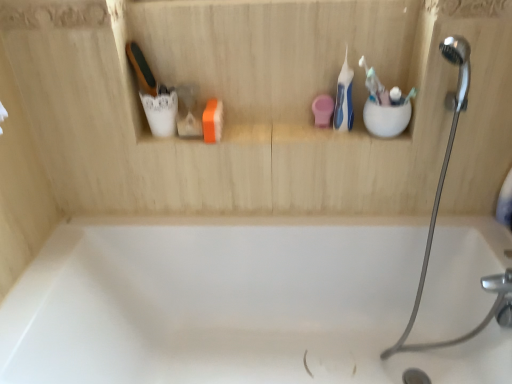
Image resolution: width=512 pixels, height=384 pixels. Describe the element at coordinates (374, 85) in the screenshot. I see `white plastic toothbrush at upper right, which is counted as the second toothbrush, starting from the left` at that location.

What do you see at coordinates (441, 171) in the screenshot? I see `silver metallic shower head at upper right` at bounding box center [441, 171].

This screenshot has height=384, width=512. I want to click on white glossy bathtub at center, so click(228, 305).

The image size is (512, 384). In order to click on white plastic toothbrush at upper right, the second toothbrush when ordered from right to left in this screenshot , I will do `click(374, 85)`.

From a real-world perspective, is white glossy bathtub at center physically above white plastic toothbrush at upper right, which is counted as the second toothbrush, starting from the left?

No, from a real-world perspective, white glossy bathtub at center is not on top of white plastic toothbrush at upper right, which is counted as the second toothbrush, starting from the left.

Who is shorter, white glossy bathtub at center or white plastic toothbrush at upper right, which is counted as the second toothbrush, starting from the left?

white plastic toothbrush at upper right, which is counted as the second toothbrush, starting from the left.

From the image's perspective, is white glossy bathtub at center above or below white plastic toothbrush at upper right, the second toothbrush when ordered from right to left?

white glossy bathtub at center is situated lower than white plastic toothbrush at upper right, the second toothbrush when ordered from right to left, in the image.

Is white glossy bathtub at center not near white plastic toothbrush at upper right, the second toothbrush when ordered from right to left?

Actually, white glossy bathtub at center and white plastic toothbrush at upper right, the second toothbrush when ordered from right to left, are a little close together.

Considering the positions of point (346, 95) and point (456, 113), is point (346, 95) closer or farther from the camera than point (456, 113)?

Point (346, 95) is farther from the camera than point (456, 113).

From a real-world perspective, is blue plastic toothbrush at upper right, arranged as the 3th toothbrush when viewed from the right, over silver metallic shower head at upper right?

Yes, from a real-world perspective, blue plastic toothbrush at upper right, arranged as the 3th toothbrush when viewed from the right, is above silver metallic shower head at upper right.

Which is in front, blue plastic toothbrush at upper right, the 1th toothbrush from the left, or silver metallic shower head at upper right?

Answer: silver metallic shower head at upper right is more forward.

Is point (105, 362) closer or farther from the camera than point (413, 87)?

Point (105, 362) is closer to the camera than point (413, 87).

Which of these two, white glossy bathtub at center or white plastic toothbrush at upper right, which is counted as the 1th toothbrush, starting from the right, is smaller?

With smaller size is white plastic toothbrush at upper right, which is counted as the 1th toothbrush, starting from the right.

From a real-world perspective, which is physically above, white glossy bathtub at center or white plastic toothbrush at upper right, which is counted as the 1th toothbrush, starting from the right?

white plastic toothbrush at upper right, which is counted as the 1th toothbrush, starting from the right, is physically above.

Can you tell me how much white glossy bathtub at center and white plastic toothbrush at upper right, the third toothbrush in the left-to-right sequence, differ in facing direction?

There is a 4.35-degree angle between the facing directions of white glossy bathtub at center and white plastic toothbrush at upper right, the third toothbrush in the left-to-right sequence.

In terms of height, does white plastic toothbrush at upper right, the third toothbrush in the left-to-right sequence, look taller or shorter compared to silver metallic shower head at upper right?

Clearly, white plastic toothbrush at upper right, the third toothbrush in the left-to-right sequence, is shorter compared to silver metallic shower head at upper right.

Which object is wider, white plastic toothbrush at upper right, the third toothbrush in the left-to-right sequence, or silver metallic shower head at upper right?

With larger width is silver metallic shower head at upper right.

Does white plastic toothbrush at upper right, the third toothbrush in the left-to-right sequence, come behind silver metallic shower head at upper right?

Yes, white plastic toothbrush at upper right, the third toothbrush in the left-to-right sequence, is further from the camera.

Where is `bathtub located in front of the blue plastic toothbrush at upper right, arranged as the 3th toothbrush when viewed from the right`? bathtub located in front of the blue plastic toothbrush at upper right, arranged as the 3th toothbrush when viewed from the right is located at coordinates (228, 305).

Which of these two, blue plastic toothbrush at upper right, the 1th toothbrush from the left, or white glossy bathtub at center, stands taller?

Standing taller between the two is white glossy bathtub at center.

From a real-world perspective, is blue plastic toothbrush at upper right, the 1th toothbrush from the left, above or below white glossy bathtub at center?

Clearly, from a real-world perspective, blue plastic toothbrush at upper right, the 1th toothbrush from the left, is above white glossy bathtub at center.

Is blue plastic toothbrush at upper right, arranged as the 3th toothbrush when viewed from the right, positioned with its back to white glossy bathtub at center?

blue plastic toothbrush at upper right, arranged as the 3th toothbrush when viewed from the right, is not turned away from white glossy bathtub at center.

Is there a large distance between white plastic toothbrush at upper right, the second toothbrush when ordered from right to left, and silver metallic shower head at upper right?

white plastic toothbrush at upper right, the second toothbrush when ordered from right to left, is actually quite close to silver metallic shower head at upper right.

Is white plastic toothbrush at upper right, which is counted as the second toothbrush, starting from the left, turned away from silver metallic shower head at upper right?

No, white plastic toothbrush at upper right, which is counted as the second toothbrush, starting from the left,'s orientation is not away from silver metallic shower head at upper right.

Which of these two, white plastic toothbrush at upper right, the second toothbrush when ordered from right to left, or silver metallic shower head at upper right, stands taller?

silver metallic shower head at upper right is taller.

Which object is more forward, white plastic toothbrush at upper right, which is counted as the second toothbrush, starting from the left, or silver metallic shower head at upper right?

silver metallic shower head at upper right is in front.

Measure the distance between white plastic toothbrush at upper right, the second toothbrush when ordered from right to left, and white glossy bathtub at center.

31.87 inches.

Could you tell me if white plastic toothbrush at upper right, the second toothbrush when ordered from right to left, is facing white glossy bathtub at center?

No, white plastic toothbrush at upper right, the second toothbrush when ordered from right to left, is not aimed at white glossy bathtub at center.

From a real-world perspective, is white plastic toothbrush at upper right, which is counted as the second toothbrush, starting from the left, under white glossy bathtub at center?

No, from a real-world perspective, white plastic toothbrush at upper right, which is counted as the second toothbrush, starting from the left, is not under white glossy bathtub at center.

In the scene shown: Is white plastic toothbrush at upper right, which is counted as the second toothbrush, starting from the left, further to the viewer compared to white glossy bathtub at center?

Yes, it is.

At what (x,y) coordinates should I click in order to perform the action: click on bathtub that appears on the left of white plastic toothbrush at upper right, which is counted as the second toothbrush, starting from the left. Please return your answer as a coordinate pair (x, y). Looking at the image, I should click on (228, 305).

You are a GUI agent. You are given a task and a screenshot of the screen. Output one action in this format:
    pyautogui.click(x=<x>, y=<y>)
    Task: Click on the shower on the right of blue plastic toothbrush at upper right, the 1th toothbrush from the left
    This screenshot has width=512, height=384.
    Given the screenshot: What is the action you would take?
    pyautogui.click(x=441, y=171)

Based on the photo, based on their spatial positions, is white plastic toothbrush at upper right, the third toothbrush in the left-to-right sequence, or blue plastic toothbrush at upper right, the 1th toothbrush from the left, closer to silver metallic shower head at upper right?

Among the two, blue plastic toothbrush at upper right, the 1th toothbrush from the left, is located nearer to silver metallic shower head at upper right.

Considering their positions, is white plastic toothbrush at upper right, the second toothbrush when ordered from right to left, positioned closer to silver metallic shower head at upper right than white plastic toothbrush at upper right, which is counted as the 1th toothbrush, starting from the right?

The object closer to silver metallic shower head at upper right is white plastic toothbrush at upper right, the second toothbrush when ordered from right to left.

Based on their spatial positions, is silver metallic shower head at upper right or white glossy bathtub at center closer to white plastic toothbrush at upper right, which is counted as the 1th toothbrush, starting from the right?

Among the two, silver metallic shower head at upper right is located nearer to white plastic toothbrush at upper right, which is counted as the 1th toothbrush, starting from the right.

From the image, which object appears to be farther from silver metallic shower head at upper right, white glossy bathtub at center or white plastic toothbrush at upper right, the second toothbrush when ordered from right to left?

Based on the image, white glossy bathtub at center appears to be further to silver metallic shower head at upper right.

Considering their positions, is white plastic toothbrush at upper right, the second toothbrush when ordered from right to left, positioned further to blue plastic toothbrush at upper right, the 1th toothbrush from the left, than white plastic toothbrush at upper right, the third toothbrush in the left-to-right sequence?

Based on the image, white plastic toothbrush at upper right, the third toothbrush in the left-to-right sequence, appears to be further to blue plastic toothbrush at upper right, the 1th toothbrush from the left.

Looking at the image, which one is located further to blue plastic toothbrush at upper right, arranged as the 3th toothbrush when viewed from the right, white plastic toothbrush at upper right, which is counted as the second toothbrush, starting from the left, or white glossy bathtub at center?

Among the two, white glossy bathtub at center is located further to blue plastic toothbrush at upper right, arranged as the 3th toothbrush when viewed from the right.

When comparing their distances from white plastic toothbrush at upper right, which is counted as the 1th toothbrush, starting from the right, does silver metallic shower head at upper right or white plastic toothbrush at upper right, the second toothbrush when ordered from right to left, seem closer?

white plastic toothbrush at upper right, the second toothbrush when ordered from right to left.

Estimate the real-world distances between objects in this image. Which object is further from white plastic toothbrush at upper right, which is counted as the second toothbrush, starting from the left, white glossy bathtub at center or silver metallic shower head at upper right?

Based on the image, white glossy bathtub at center appears to be further to white plastic toothbrush at upper right, which is counted as the second toothbrush, starting from the left.

Where is `shower between white plastic toothbrush at upper right, the second toothbrush when ordered from right to left, and white glossy bathtub at center from top to bottom`? This screenshot has width=512, height=384. shower between white plastic toothbrush at upper right, the second toothbrush when ordered from right to left, and white glossy bathtub at center from top to bottom is located at coordinates (441, 171).

I want to click on shower between white plastic toothbrush at upper right, which is counted as the 1th toothbrush, starting from the right, and white glossy bathtub at center in the up-down direction, so click(x=441, y=171).

At what (x,y) coordinates should I click in order to perform the action: click on shower between blue plastic toothbrush at upper right, arranged as the 3th toothbrush when viewed from the right, and white glossy bathtub at center from top to bottom. Please return your answer as a coordinate pair (x, y). The width and height of the screenshot is (512, 384). Looking at the image, I should click on (x=441, y=171).

Locate an element on the screen. The image size is (512, 384). toothbrush between blue plastic toothbrush at upper right, arranged as the 3th toothbrush when viewed from the right, and white plastic toothbrush at upper right, which is counted as the 1th toothbrush, starting from the right, from left to right is located at coordinates (374, 85).